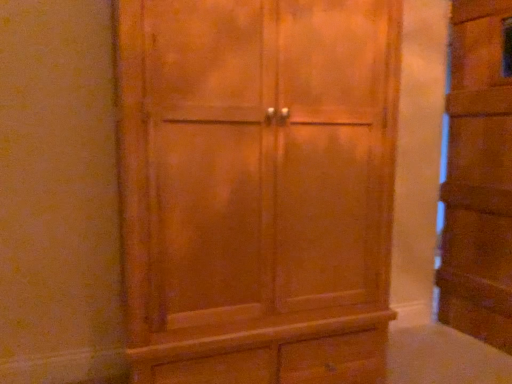
Question: From the image's perspective, relative to matte wood cupboard at center, which is counted as the 1th cupboard, starting from the left, is wooden cabinet at right, placed as the second cupboard when sorted from left to right, above or below?

Choices:
 (A) below
 (B) above

Answer: (B)

Question: Choose the correct answer: Is wooden cabinet at right, placed as the second cupboard when sorted from left to right, inside matte wood cupboard at center, acting as the 2th cupboard starting from the right, or outside it?

Choices:
 (A) outside
 (B) inside

Answer: (A)

Question: In terms of width, does wooden cabinet at right, placed as the second cupboard when sorted from left to right, look wider or thinner when compared to matte wood cupboard at center, which is counted as the 1th cupboard, starting from the left?

Choices:
 (A) thin
 (B) wide

Answer: (A)

Question: From a real-world perspective, is matte wood cupboard at center, which is counted as the 1th cupboard, starting from the left, positioned above or below wooden cabinet at right, placed as the second cupboard when sorted from left to right?

Choices:
 (A) below
 (B) above

Answer: (A)

Question: In terms of height, does matte wood cupboard at center, acting as the 2th cupboard starting from the right, look taller or shorter compared to wooden cabinet at right, placed as the second cupboard when sorted from left to right?

Choices:
 (A) tall
 (B) short

Answer: (B)

Question: From the image's perspective, is matte wood cupboard at center, acting as the 2th cupboard starting from the right, above or below wooden cabinet at right, placed as the second cupboard when sorted from left to right?

Choices:
 (A) below
 (B) above

Answer: (A)

Question: Is point (158, 29) closer or farther from the camera than point (506, 137)?

Choices:
 (A) closer
 (B) farther

Answer: (A)